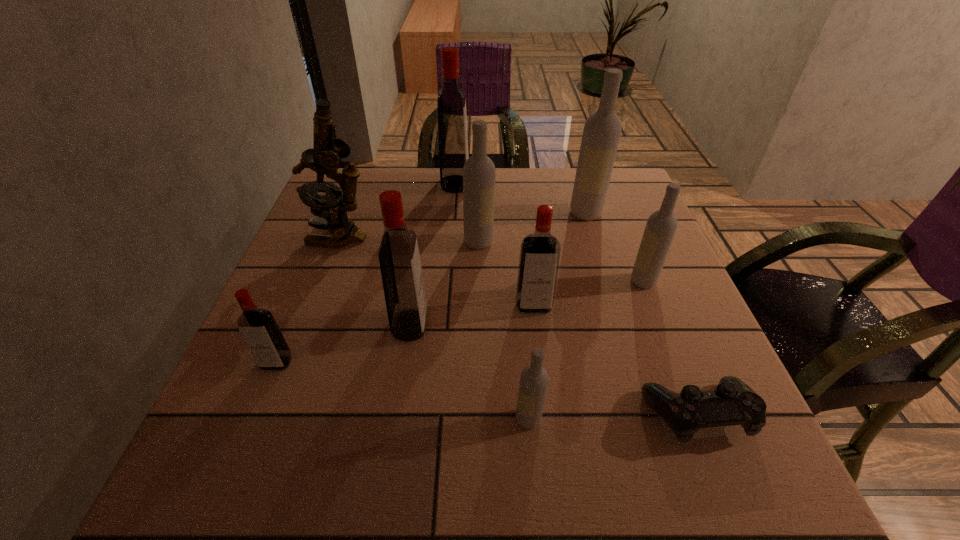
You are a GUI agent. You are given a task and a screenshot of the screen. Output one action in this format:
    pyautogui.click(x=<x>, y=<y>)
    Task: Click on the vodka that stands as the third closest to the second vodka from right to left
    The height and width of the screenshot is (540, 960).
    Given the screenshot: What is the action you would take?
    pyautogui.click(x=452, y=119)

This screenshot has width=960, height=540. Identify the location of the closest red vodka to the second farthest white vodka. (539, 258).

The height and width of the screenshot is (540, 960). Find the location of `red vodka that is the third closest to the control`. red vodka that is the third closest to the control is located at coordinates (258, 327).

Find the location of a particular element. The image size is (960, 540). the closest white vodka relative to the third smallest red vodka is located at coordinates (479, 170).

Find the location of `white vodka that is the closest to the farthest object`. white vodka that is the closest to the farthest object is located at coordinates (479, 170).

At what (x,y) coordinates should I click in order to perform the action: click on blank space that satisfies the following two spatial constraints: 1. on the front and back of the nearest vodka; 2. on the right side of the farthest red vodka. Please return your answer as a coordinate pair (x, y). The height and width of the screenshot is (540, 960). Looking at the image, I should click on (437, 419).

Locate an element on the screen. This screenshot has width=960, height=540. free spot that satisfies the following two spatial constraints: 1. on the front and back of the control; 2. on the left side of the seventh farthest vodka is located at coordinates (255, 414).

Where is `vacant space that satisfies the following two spatial constraints: 1. on the front and back of the control; 2. on the left side of the rightmost red vodka`? The width and height of the screenshot is (960, 540). vacant space that satisfies the following two spatial constraints: 1. on the front and back of the control; 2. on the left side of the rightmost red vodka is located at coordinates (547, 414).

Where is `free point that satisfies the following two spatial constraints: 1. on the front side of the control; 2. on the left side of the third farthest vodka`? This screenshot has height=540, width=960. free point that satisfies the following two spatial constraints: 1. on the front side of the control; 2. on the left side of the third farthest vodka is located at coordinates (478, 414).

I want to click on free space that satisfies the following two spatial constraints: 1. on the front side of the microscope; 2. on the left side of the smallest white vodka, so click(x=274, y=419).